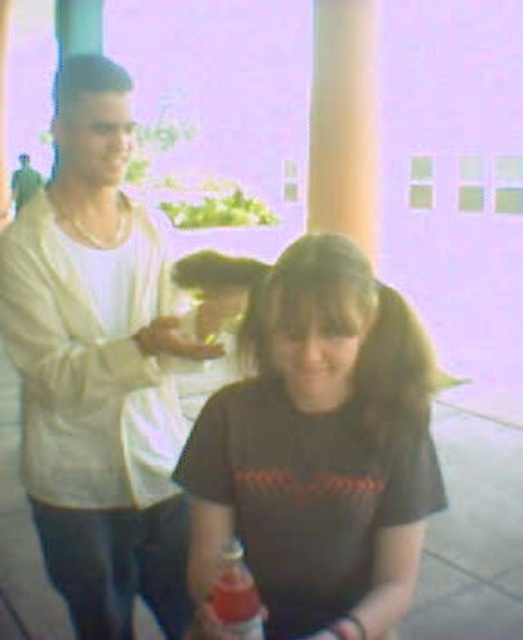
Question: Among these objects, which one is nearest to the camera?

Choices:
 (A) matte black shirt at center
 (B) dark brown t-shirt at center
 (C) smooth concrete pavement at center
 (D) matte white shirt at center

Answer: (B)

Question: Can you confirm if matte black shirt at center is wider than translucent plastic bottle at center?

Choices:
 (A) no
 (B) yes

Answer: (B)

Question: Considering the relative positions of translucent plastic bottle at center and matte white shirt at center in the image provided, where is translucent plastic bottle at center located with respect to matte white shirt at center?

Choices:
 (A) below
 (B) above

Answer: (A)

Question: Does matte black shirt at center appear on the left side of translucent plastic bottle at center?

Choices:
 (A) no
 (B) yes

Answer: (B)

Question: Which object is the closest to the smooth concrete pavement at center?

Choices:
 (A) translucent plastic bottle at center
 (B) matte white shirt at center
 (C) matte black shirt at center
 (D) dark brown t-shirt at center

Answer: (C)

Question: Which of the following is the closest to the observer?

Choices:
 (A) dark brown t-shirt at center
 (B) smooth concrete pavement at center
 (C) translucent plastic bottle at center

Answer: (C)